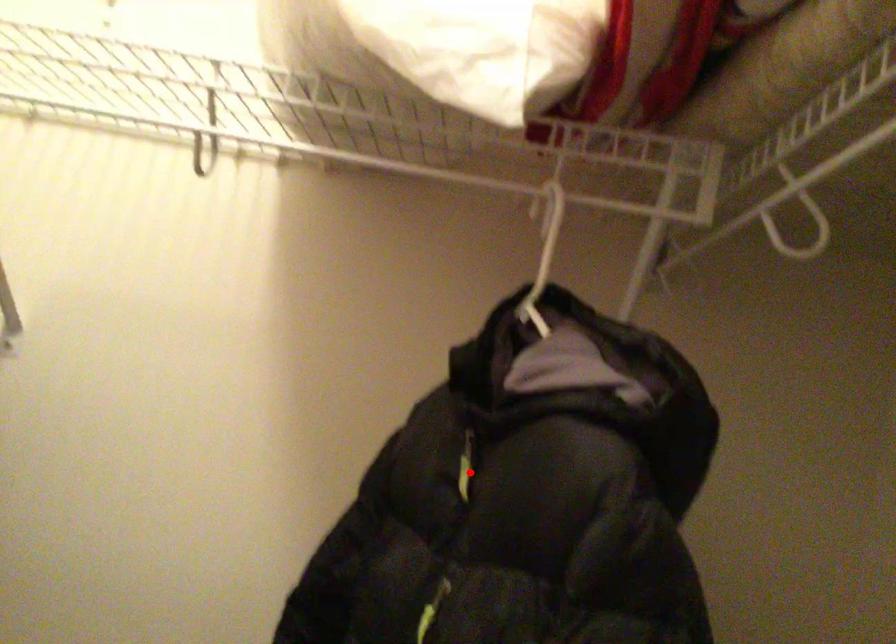
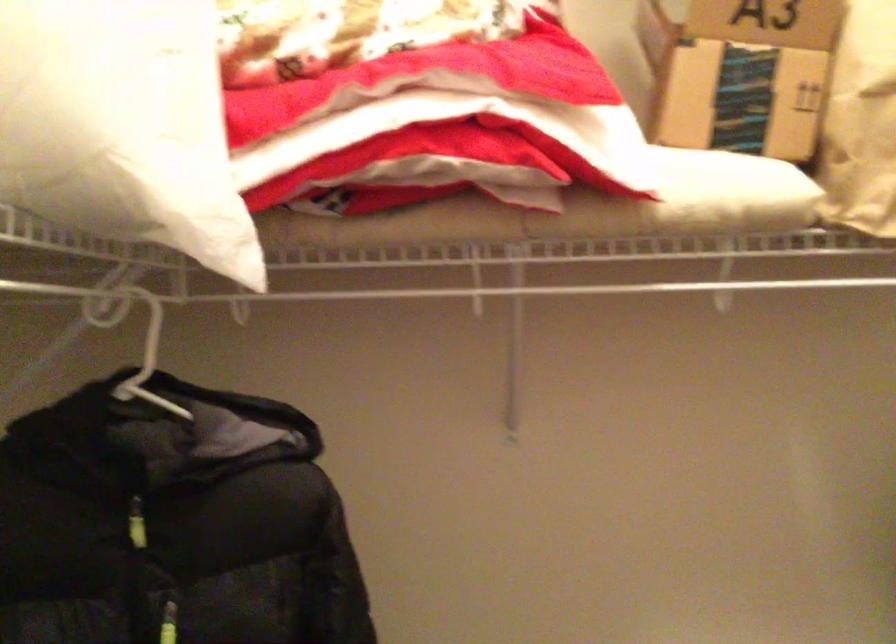
In the second image, find the point that corresponds to the highlighted location in the first image.

(136, 524)